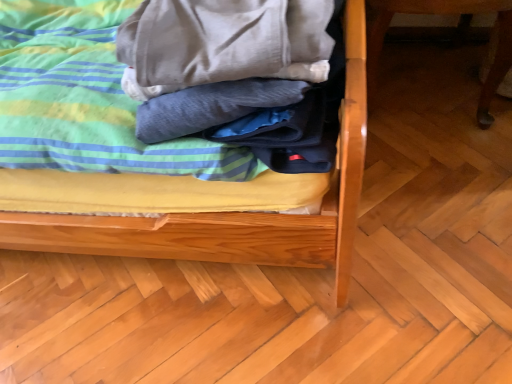
Measure the distance between soft cotton bed at center and camera.

They are 21.25 inches apart.

Locate an element on the screen. This screenshot has width=512, height=384. soft cotton blanket at center is located at coordinates (86, 98).

Measure the distance between point (370, 87) and camera.

The depth of point (370, 87) is 4.19 feet.

Where is `soft cotton bed at center`? Image resolution: width=512 pixels, height=384 pixels. soft cotton bed at center is located at coordinates (207, 202).

Is soft cotton blanket at center wider than wooden table leg at right?

No, soft cotton blanket at center is not wider than wooden table leg at right.

From a real-world perspective, is soft cotton blanket at center physically below wooden table leg at right?

Actually, soft cotton blanket at center is physically above wooden table leg at right in the real world.

Locate an element on the screen. The image size is (512, 384). blanket that is below the wooden table leg at right (from the image's perspective) is located at coordinates (86, 98).

From the image's perspective, is soft cotton blanket at center on wooden table leg at right?

Actually, soft cotton blanket at center appears below wooden table leg at right in the image.

From the picture: Choose the correct answer: Is wooden table leg at right inside soft cotton bed at center or outside it?

wooden table leg at right exists outside the volume of soft cotton bed at center.

Is point (495, 61) closer or farther from the camera than point (351, 50)?

Point (495, 61).

Can you confirm if wooden table leg at right is positioned to the left of soft cotton bed at center?

No.

You are a GUI agent. You are given a task and a screenshot of the screen. Output one action in this format:
    pyautogui.click(x=<x>, y=<y>)
    Task: Click on the bed that is under the soft cotton blanket at center (from a real-world perspective)
    Image resolution: width=512 pixels, height=384 pixels.
    Given the screenshot: What is the action you would take?
    207,202

Can you confirm if soft cotton blanket at center is taller than soft cotton bed at center?

Incorrect, the height of soft cotton blanket at center is not larger of that of soft cotton bed at center.

Considering the relative positions of soft cotton blanket at center and soft cotton bed at center in the image provided, is soft cotton blanket at center behind soft cotton bed at center?

That is True.

Which of these two, soft cotton blanket at center or soft cotton bed at center, is smaller?

soft cotton blanket at center is smaller.

Does soft cotton bed at center have a larger size compared to soft cotton blanket at center?

Yes, soft cotton bed at center is bigger than soft cotton blanket at center.

Is soft cotton blanket at center at the back of soft cotton bed at center?

No, soft cotton bed at center's orientation is not away from soft cotton blanket at center.

Is soft cotton blanket at center completely or partially inside soft cotton bed at center?

Yes, soft cotton bed at center is surrounding soft cotton blanket at center.

Is wooden table leg at right looking in the opposite direction of soft cotton blanket at center?

No.

Based on the photo, which of these two, wooden table leg at right or soft cotton blanket at center, is smaller?

soft cotton blanket at center is smaller.

Looking at this image, is wooden table leg at right wider than soft cotton blanket at center?

Correct, the width of wooden table leg at right exceeds that of soft cotton blanket at center.

Is wooden table leg at right closer to the viewer compared to soft cotton blanket at center?

No, it is not.

From the image's perspective, is soft cotton bed at center on top of wooden table leg at right?

Actually, soft cotton bed at center appears below wooden table leg at right in the image.

What's the angular difference between soft cotton bed at center and wooden table leg at right's facing directions?

There is a 0.856-degree angle between the facing directions of soft cotton bed at center and wooden table leg at right.

You are a GUI agent. You are given a task and a screenshot of the screen. Output one action in this format:
    pyautogui.click(x=<x>, y=<y>)
    Task: Click on the bed lying on the left of wooden table leg at right
    
    Given the screenshot: What is the action you would take?
    pyautogui.click(x=207, y=202)

Where is `furniture below the soft cotton blanket at center (from a real-world perspective)`? furniture below the soft cotton blanket at center (from a real-world perspective) is located at coordinates [445, 13].

Where is `bed located in front of the wooden table leg at right`? bed located in front of the wooden table leg at right is located at coordinates (207, 202).

Looking at the image, which one is located closer to soft cotton blanket at center, wooden table leg at right or soft cotton bed at center?

soft cotton bed at center lies closer to soft cotton blanket at center than the other object.

Based on the photo, based on their spatial positions, is soft cotton blanket at center or wooden table leg at right further from soft cotton bed at center?

Based on the image, wooden table leg at right appears to be further to soft cotton bed at center.

Considering their positions, is soft cotton blanket at center positioned closer to wooden table leg at right than soft cotton bed at center?

soft cotton bed at center is closer to wooden table leg at right.

Considering their positions, is soft cotton bed at center positioned further to wooden table leg at right than soft cotton blanket at center?

soft cotton blanket at center is positioned further to the anchor wooden table leg at right.

Looking at the image, which one is located closer to soft cotton blanket at center, soft cotton bed at center or wooden table leg at right?

soft cotton bed at center.

From the image, which object appears to be nearer to soft cotton bed at center, wooden table leg at right or soft cotton blanket at center?

soft cotton blanket at center is positioned closer to the anchor soft cotton bed at center.

At what (x,y) coordinates should I click in order to perform the action: click on blanket between soft cotton bed at center and wooden table leg at right. Please return your answer as a coordinate pair (x, y). This screenshot has width=512, height=384. Looking at the image, I should click on (86, 98).